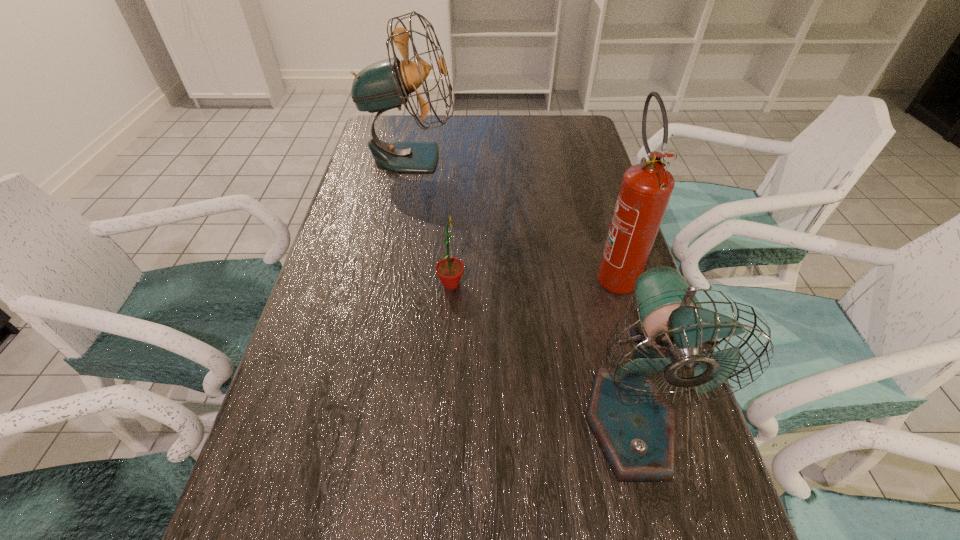
This screenshot has width=960, height=540. I want to click on object at the far edge, so [384, 85].

I want to click on object that is at the left edge, so click(384, 85).

This screenshot has width=960, height=540. I want to click on fire extinguisher positioned at the right edge, so click(646, 188).

Identify the location of fan at the right edge. Image resolution: width=960 pixels, height=540 pixels. (631, 420).

Identify the location of object located at the far left corner. (384, 85).

Find the location of `free space at the far edge of the desktop`. free space at the far edge of the desktop is located at coordinates (455, 146).

The image size is (960, 540). In the image, there is a desktop. In order to click on vacant region at the left edge in this screenshot , I will do `click(326, 366)`.

In the image, there is a desktop. Where is `free space at the right edge`? free space at the right edge is located at coordinates (580, 205).

Find the location of a particular element. The width and height of the screenshot is (960, 540). free region at the far right corner of the desktop is located at coordinates (578, 127).

Where is `vacant region between the fire extinguisher and the right fan`? This screenshot has height=540, width=960. vacant region between the fire extinguisher and the right fan is located at coordinates (622, 348).